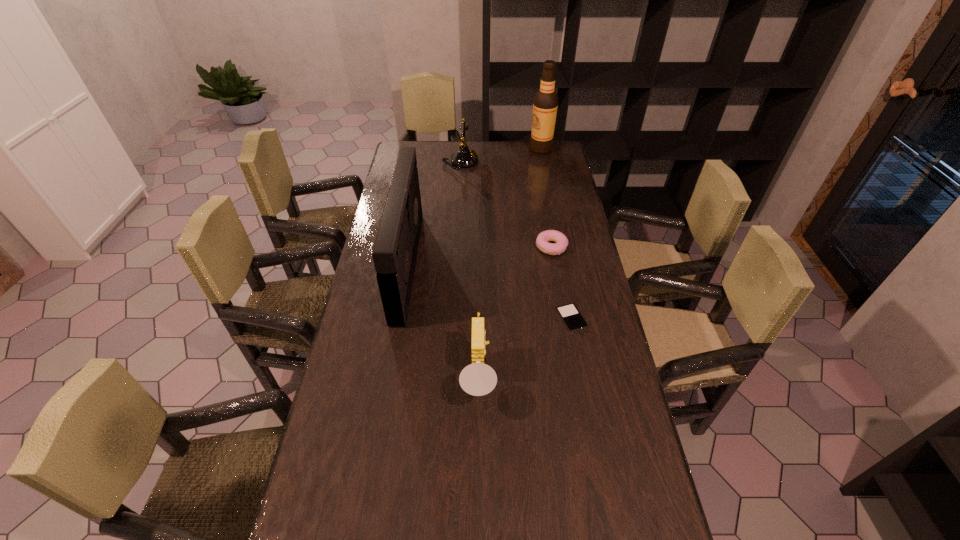
Where is `empty space between the alcohol and the second tallest object`? The width and height of the screenshot is (960, 540). empty space between the alcohol and the second tallest object is located at coordinates (474, 207).

Locate an element on the screen. The width and height of the screenshot is (960, 540). free space between the videotape and the tallest object is located at coordinates (474, 207).

Where is `vacant area that lies between the alcohol and the telephone`? vacant area that lies between the alcohol and the telephone is located at coordinates (501, 156).

I want to click on free spot between the doughnut and the alcohol, so click(x=546, y=198).

Image resolution: width=960 pixels, height=540 pixels. Identify the location of object that is the fourth nearest to the doughnut. (463, 158).

Locate which object ranks fifth in proximity to the telephone. Please provide its 2D coordinates. Your answer should be formatted as a tuple, i.e. [(x, y)], where the tuple contains the x and y coordinates of a point satisfying the conditions above.

[(477, 379)]

In order to click on blank area in the image that satisfies the following two spatial constraints: 1. on the front side of the shortest object; 2. on the left side of the fifth shortest object in this screenshot , I will do (x=398, y=319).

Find the location of a particular element. The width and height of the screenshot is (960, 540). vacant position in the image that satisfies the following two spatial constraints: 1. on the dial of the fifth tallest object; 2. on the left side of the telephone is located at coordinates (455, 247).

Locate an element on the screen. The height and width of the screenshot is (540, 960). free space that satisfies the following two spatial constraints: 1. on the dial of the telephone; 2. on the left side of the fifth tallest object is located at coordinates (455, 247).

Image resolution: width=960 pixels, height=540 pixels. In order to click on vacant area in the image that satisfies the following two spatial constraints: 1. on the dial of the telephone; 2. on the left side of the doughnut in this screenshot , I will do `click(455, 247)`.